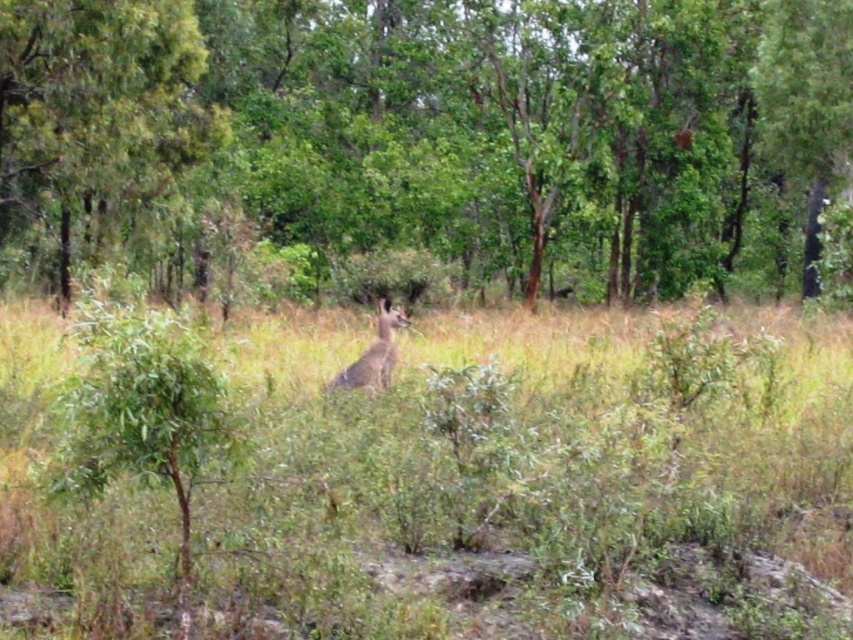
Is green leafy tree at upper left to the right of brown fur kangaroo at center from the viewer's perspective?

In fact, green leafy tree at upper left is to the left of brown fur kangaroo at center.

The image size is (853, 640). What do you see at coordinates (96, 116) in the screenshot?
I see `green leafy tree at upper left` at bounding box center [96, 116].

Image resolution: width=853 pixels, height=640 pixels. I want to click on green leafy tree at upper left, so click(96, 116).

Identify the location of brown textured tree at center. The height and width of the screenshot is (640, 853). (428, 138).

Find the location of a particular element. brown textured tree at center is located at coordinates (428, 138).

Is point (210, 253) less distant than point (733, 403)?

That is False.

Is point (695, 6) farther from camera compared to point (398, 515)?

Yes, it is behind point (398, 515).

Does point (453, 266) come closer to viewer compared to point (726, 611)?

No, (453, 266) is further to viewer.

You are a GUI agent. You are given a task and a screenshot of the screen. Output one action in this format:
    pyautogui.click(x=<x>, y=<y>)
    Task: Click on the brown textured tree at center
    
    Given the screenshot: What is the action you would take?
    pyautogui.click(x=428, y=138)